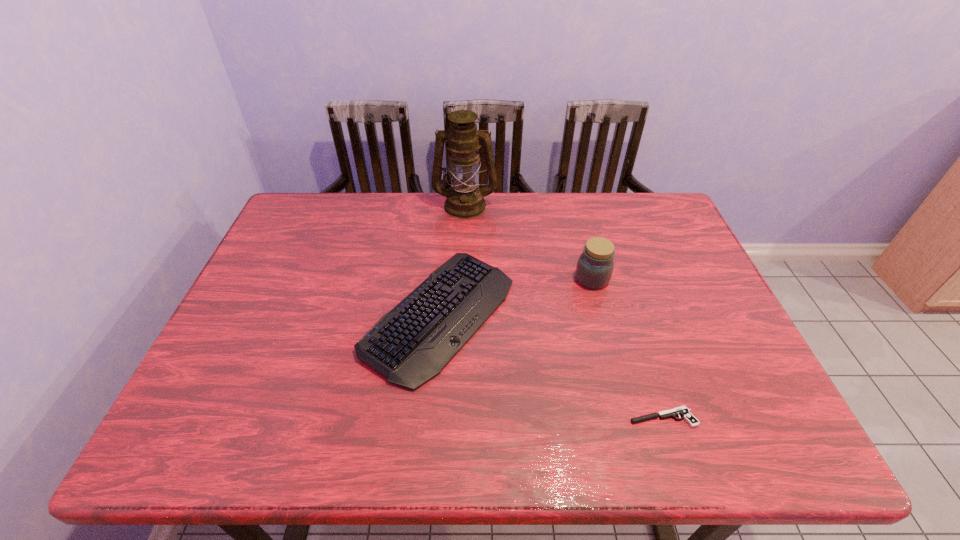
The width and height of the screenshot is (960, 540). Find the location of `the tallest object`. the tallest object is located at coordinates (464, 200).

Locate an element on the screen. oil lamp is located at coordinates (464, 200).

At what (x,y) coordinates should I click in order to perform the action: click on jar. Please return your answer as a coordinate pair (x, y). This screenshot has height=540, width=960. Looking at the image, I should click on pyautogui.click(x=595, y=265).

This screenshot has width=960, height=540. In order to click on the third tallest object in this screenshot , I will do `click(411, 344)`.

Where is `pistol`? pistol is located at coordinates (685, 413).

Identify the location of the shortest object. (685, 413).

Where is `free space located on the front of the tallest object`? This screenshot has width=960, height=540. free space located on the front of the tallest object is located at coordinates (463, 274).

I want to click on vacant region located 0.090m on the front of the jar, so click(602, 316).

What are the coordinates of `free region located 0.350m on the back of the computer keyboard` in the screenshot? It's located at (450, 192).

I want to click on blank space located on the front-facing side of the pistol, so click(548, 417).